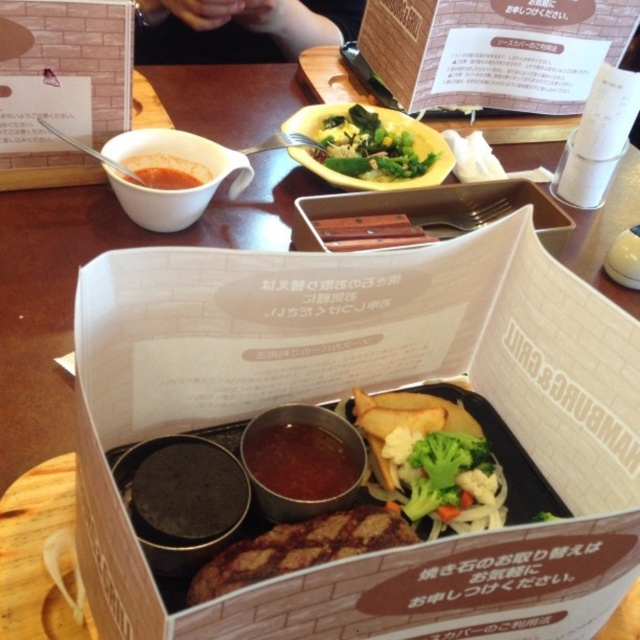
Is matte white bowl at upper left in front of thick brown sauce at center?

That is False.

Between matte white bowl at upper left and thick brown sauce at center, which one appears on the left side from the viewer's perspective?

Positioned to the left is matte white bowl at upper left.

Describe the element at coordinates (61, 86) in the screenshot. The width and height of the screenshot is (640, 640). I see `matte white bowl at upper left` at that location.

You are a GUI agent. You are given a task and a screenshot of the screen. Output one action in this format:
    pyautogui.click(x=<x>, y=<y>)
    Task: Click on the matte white bowl at upper left
    
    Given the screenshot: What is the action you would take?
    pyautogui.click(x=61, y=86)

Describe the element at coordinates (493, 51) in the screenshot. Image resolution: width=640 pixels, height=640 pixels. I see `white cardboard box at upper center` at that location.

Which is above, white cardboard box at upper center or thick brown sauce at center?

Positioned higher is white cardboard box at upper center.

What are the coordinates of `white cardboard box at upper center` in the screenshot? It's located at (493, 51).

Between point (588, 19) and point (353, 163), which one is positioned behind?

Positioned behind is point (588, 19).

The height and width of the screenshot is (640, 640). What are the coordinates of `white cardboard box at upper center` in the screenshot? It's located at (493, 51).